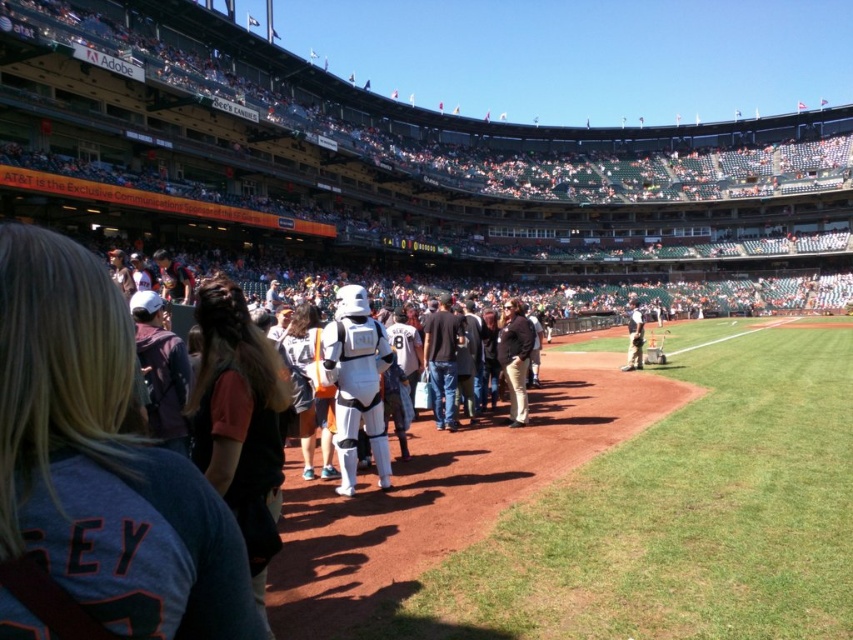
Question: Based on their relative distances, which object is farther from the white plastic stormtrooper at center?

Choices:
 (A) dark brown leather jacket at center
 (B) white plastic helmet at center

Answer: (B)

Question: Which object is positioned farthest from the white plastic helmet at center?

Choices:
 (A) white plastic stormtrooper at center
 (B) dark brown leather jacket at center

Answer: (A)

Question: Can you confirm if white plastic stormtrooper at center is positioned below dark brown leather jacket at center?

Choices:
 (A) yes
 (B) no

Answer: (B)

Question: Is white plastic stormtrooper at center thinner than dark brown leather jacket at center?

Choices:
 (A) no
 (B) yes

Answer: (A)

Question: Which point is farther from the camera taking this photo?

Choices:
 (A) (531, 339)
 (B) (636, 321)

Answer: (B)

Question: Does dark brown leather jacket at center come in front of white plastic helmet at center?

Choices:
 (A) yes
 (B) no

Answer: (A)